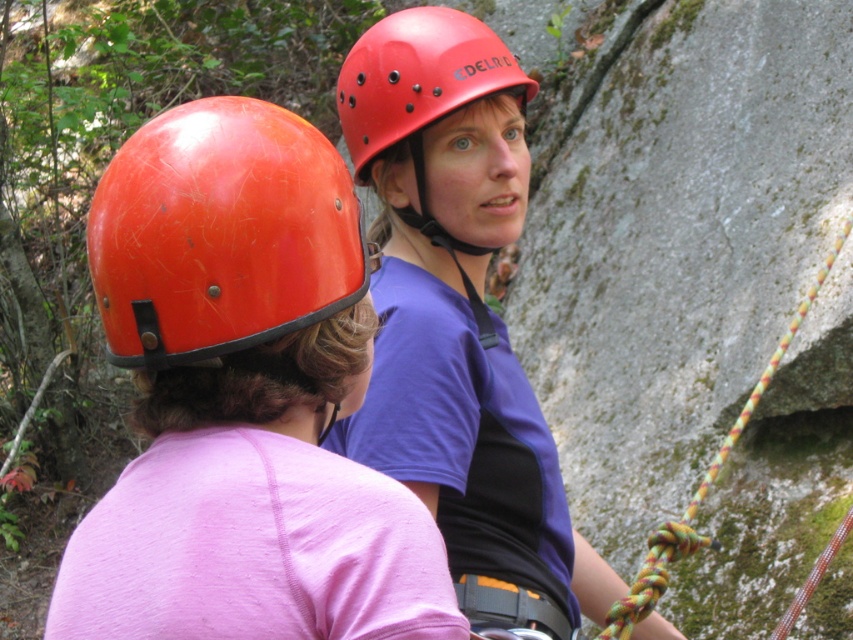
You are a rock climber who needs to locate your orange matte helmet at left. The coordinates given are point (x=221, y=234). Can you confirm if the orange matte helmet at left is exactly at that coordinate?

Yes, the orange matte helmet at left is exactly at point (x=221, y=234).

You are a photographer trying to capture the orange matte helmet at left in your shot. The camera is positioned at point (221, 234). Can you see the orange matte helmet at left from this position?

Yes, the orange matte helmet at left is located exactly at point (221, 234), so the photographer can see it from the camera position at that point.

You are a rock climber preparing to ascend a route and notice the matte orange helmet at upper center. If you want to grab it, is it within your reach without moving your feet?

The matte orange helmet at upper center is 1.74 meters from the viewer, which is beyond typical arm reach. You would need to move your feet to reach it.